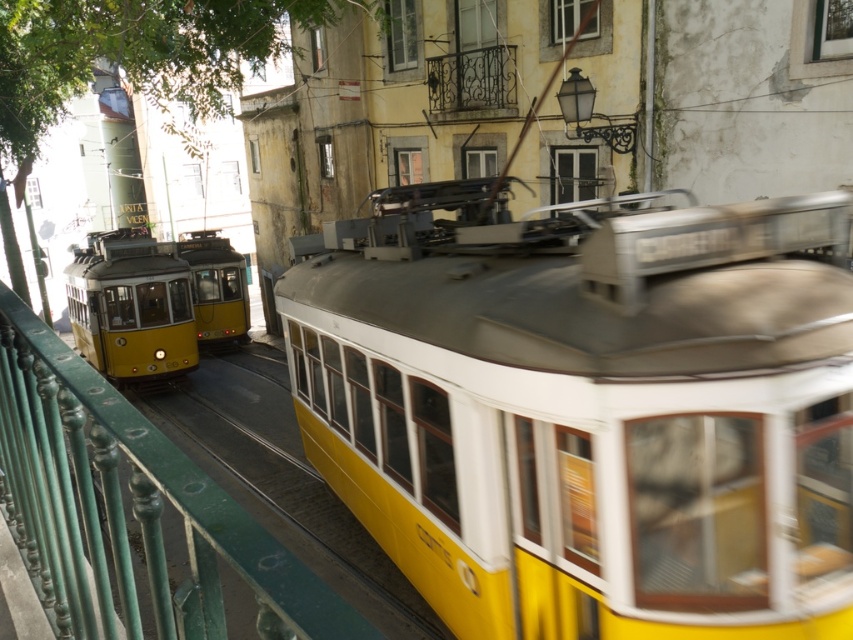
What do you see at coordinates (589, 410) in the screenshot? I see `yellow matte train at center` at bounding box center [589, 410].

This screenshot has width=853, height=640. What do you see at coordinates (589, 410) in the screenshot?
I see `yellow matte train at center` at bounding box center [589, 410].

Find the location of `yellow matte train at center`. yellow matte train at center is located at coordinates (589, 410).

Does point (28, 532) lie in front of point (212, 288)?

Yes, point (28, 532) is closer to viewer.

Between green polished metal rail at center and yellow matte tram at left, which one has more height?

green polished metal rail at center

Which is behind, point (74, 589) or point (228, 241)?

The point (228, 241) is more distant.

At what (x,y) coordinates should I click in order to perform the action: click on green polished metal rail at center. Please return your answer as a coordinate pair (x, y). Looking at the image, I should click on (129, 509).

Is yellow polished metal tram at left to the left of yellow matte tram at left from the viewer's perspective?

Yes, yellow polished metal tram at left is to the left of yellow matte tram at left.

Who is more forward, (x=165, y=273) or (x=183, y=253)?

Point (x=165, y=273)

Identify the location of yellow polished metal tram at left. The image size is (853, 640). (131, 307).

Find the location of `yellow polished metal tram at left`. yellow polished metal tram at left is located at coordinates (x=131, y=307).